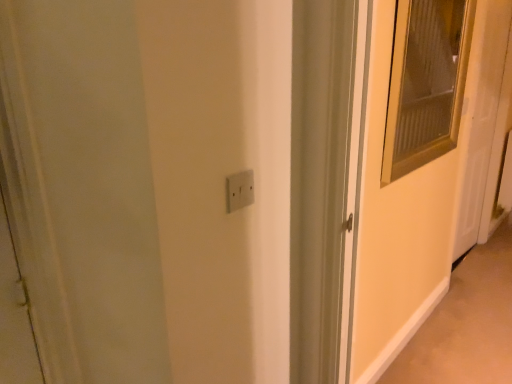
Image resolution: width=512 pixels, height=384 pixels. What do you see at coordinates (396, 227) in the screenshot? I see `matte glass screen door at right` at bounding box center [396, 227].

Identify the location of white plastic electric outlet at center. The width and height of the screenshot is (512, 384). (240, 190).

Find the location of `door lying behind the beige carpet at lower right`. door lying behind the beige carpet at lower right is located at coordinates (485, 122).

Is point (484, 204) positioned in front of point (510, 290)?

That is False.

From the image's perspective, relative to beige carpet at lower right, is white glossy door at right above or below?

white glossy door at right is above beige carpet at lower right.

Is white glossy door at right directly adjacent to beige carpet at lower right?

white glossy door at right is not next to beige carpet at lower right, and they're not touching.

Can you confirm if beige carpet at lower right is positioned to the right of white glossy door at right?

Yes, beige carpet at lower right is to the right of white glossy door at right.

Consider the image. Does beige carpet at lower right have a greater height compared to white glossy door at right?

No.

Is point (503, 369) behind point (466, 90)?

That is False.

Looking at this image, from the image's perspective, is beige carpet at lower right above or below white glossy door at right?

Based on their image positions, beige carpet at lower right is located beneath white glossy door at right.

Is point (246, 201) closer or farther from the camera than point (426, 361)?

Point (246, 201) is closer to the camera than point (426, 361).

Is white plastic electric outlet at center in front of or behind beige carpet at lower right in the image?

white plastic electric outlet at center is in front of beige carpet at lower right.

Does white plastic electric outlet at center have a greater width compared to beige carpet at lower right?

No, white plastic electric outlet at center is not wider than beige carpet at lower right.

Could you tell me if white plastic electric outlet at center is turned towards beige carpet at lower right?

No, white plastic electric outlet at center is not aimed at beige carpet at lower right.

At what (x,y) coordinates should I click in order to perform the action: click on screen door on the left of white glossy door at right. Please return your answer as a coordinate pair (x, y). Looking at the image, I should click on (396, 227).

Is matte glass screen door at right closer to the viewer compared to white glossy door at right?

Yes.

Is matte glass screen door at right to the left of white glossy door at right from the viewer's perspective?

Yes, matte glass screen door at right is to the left of white glossy door at right.

Is white plastic electric outlet at center wider or thinner than white glossy door at right?

Clearly, white plastic electric outlet at center has less width compared to white glossy door at right.

How different are the orientations of white plastic electric outlet at center and white glossy door at right in degrees?

The facing directions of white plastic electric outlet at center and white glossy door at right are 0.392 degrees apart.

From a real-world perspective, which object rests below the other?

From a 3D spatial view, white glossy door at right is below.

From the image's perspective, is white plastic electric outlet at center above white glossy door at right?

Incorrect, from the image's perspective, white plastic electric outlet at center is lower than white glossy door at right.

From a real-world perspective, is white glossy door at right under white plastic electric outlet at center?

Yes, from a real-world perspective, white glossy door at right is under white plastic electric outlet at center.

Who is shorter, white glossy door at right or white plastic electric outlet at center?

With less height is white plastic electric outlet at center.

Can you confirm if white glossy door at right is positioned to the right of white plastic electric outlet at center?

Yes.

From the image's perspective, who appears lower, white glossy door at right or white plastic electric outlet at center?

white plastic electric outlet at center appears lower in the image.

Which of these two, matte glass screen door at right or beige carpet at lower right, is thinner?

matte glass screen door at right is thinner.

In the image, there is a beige carpet at lower right. Identify the location of screen door above it (from the image's perspective). This screenshot has width=512, height=384. (396, 227).

Is matte glass screen door at right aimed at beige carpet at lower right?

No, matte glass screen door at right does not turn towards beige carpet at lower right.

Is matte glass screen door at right beside beige carpet at lower right?

No, matte glass screen door at right is not making contact with beige carpet at lower right.

The width and height of the screenshot is (512, 384). I want to click on alley on the right of white glossy door at right, so click(466, 323).

The width and height of the screenshot is (512, 384). I want to click on door above the beige carpet at lower right (from the image's perspective), so click(485, 122).

From the image, which object appears to be farther from white glossy door at right, matte glass screen door at right or white plastic electric outlet at center?

white plastic electric outlet at center lies further to white glossy door at right than the other object.

Considering their positions, is beige carpet at lower right positioned closer to white glossy door at right than white plastic electric outlet at center?

Among the two, beige carpet at lower right is located nearer to white glossy door at right.

Considering their positions, is matte glass screen door at right positioned further to white plastic electric outlet at center than white glossy door at right?

white glossy door at right is positioned further to the anchor white plastic electric outlet at center.

Looking at the image, which one is located closer to matte glass screen door at right, white plastic electric outlet at center or white glossy door at right?

white glossy door at right is positioned closer to the anchor matte glass screen door at right.

Estimate the real-world distances between objects in this image. Which object is closer to matte glass screen door at right, white plastic electric outlet at center or beige carpet at lower right?

Among the two, beige carpet at lower right is located nearer to matte glass screen door at right.

Based on the photo, from the image, which object appears to be farther from white plastic electric outlet at center, white glossy door at right or matte glass screen door at right?

white glossy door at right.

Which object lies further to the anchor point white plastic electric outlet at center, white glossy door at right or beige carpet at lower right?

white glossy door at right is positioned further to the anchor white plastic electric outlet at center.

Based on their spatial positions, is white plastic electric outlet at center or white glossy door at right closer to beige carpet at lower right?

white glossy door at right is closer to beige carpet at lower right.

Locate an element on the screen. The width and height of the screenshot is (512, 384). screen door between white plastic electric outlet at center and white glossy door at right from left to right is located at coordinates (396, 227).

Find the location of a particular element. The height and width of the screenshot is (384, 512). alley between matte glass screen door at right and white glossy door at right in the front-back direction is located at coordinates (466, 323).

Where is `screen door between white plastic electric outlet at center and beige carpet at lower right in the horizontal direction`? screen door between white plastic electric outlet at center and beige carpet at lower right in the horizontal direction is located at coordinates (396, 227).

Identify the location of door between white plastic electric outlet at center and beige carpet at lower right in the horizontal direction. The image size is (512, 384). (485, 122).